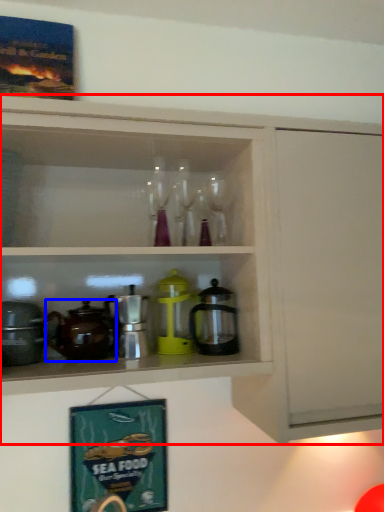
Question: Among these objects, which one is nearest to the camera, cabinetry (highlighted by a red box) or coffeepot (highlighted by a blue box)?

Choices:
 (A) cabinetry
 (B) coffeepot

Answer: (A)